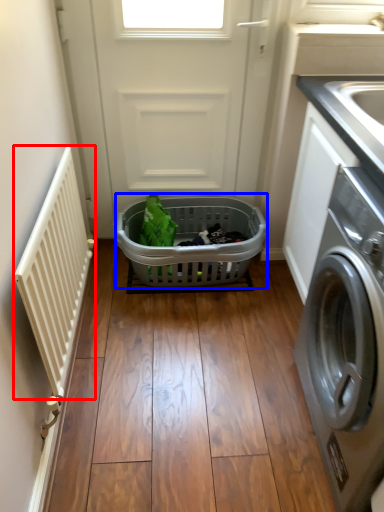
Question: Which of the following is the farthest to the observer, balustrade (highlighted by a red box) or basket (highlighted by a blue box)?

Choices:
 (A) balustrade
 (B) basket

Answer: (B)